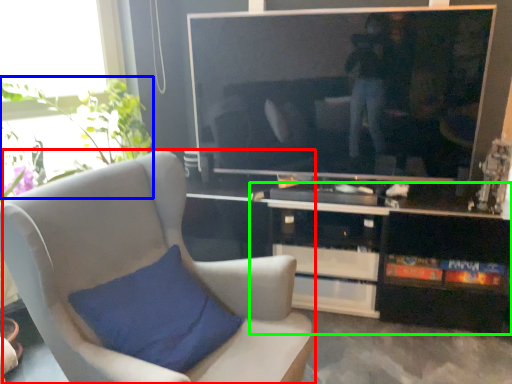
Question: Which object is the farthest from chair (highlighted by a red box)? Choose among these: plant (highlighted by a blue box) or cabinetry (highlighted by a green box).

Choices:
 (A) plant
 (B) cabinetry

Answer: (A)